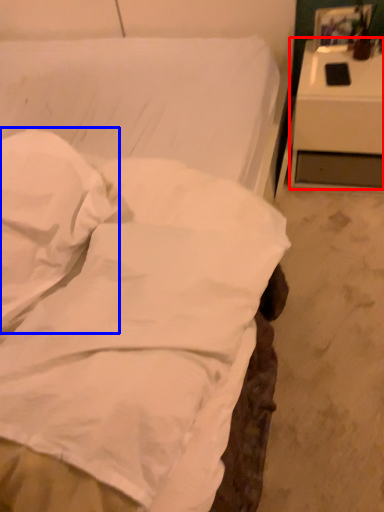
Question: Which of the following is the farthest to the observer, nightstand (highlighted by a red box) or pillow (highlighted by a blue box)?

Choices:
 (A) nightstand
 (B) pillow

Answer: (A)